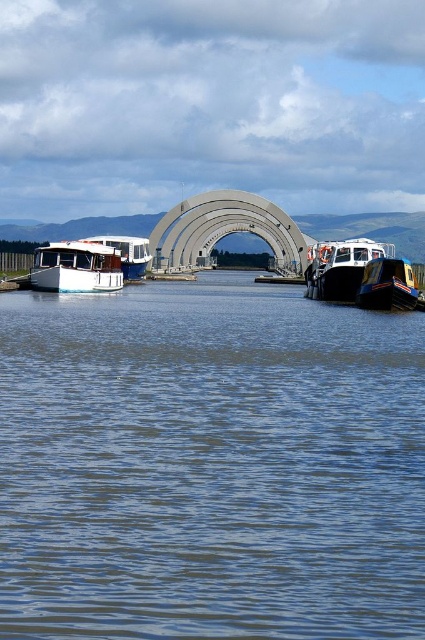
You are standing at the center of the waterway scene and want to reach both points. Which point, point [124,550] or point [37,257], will you reach first as you move forward?

You will reach point [124,550] first because it is closer to you than point [37,257].

You are a small toy boat that is 1 meter long. You want to sail through the waterway shown in the image. Can you fit between the blue water at center and the blue glossy boat at lower right without touching either?

The blue water at center is wider than the blue glossy boat at lower right. Since the waterway is wider than the boat, the toy boat can safely sail through without touching either side.

You are a tour guide leading a group on a narrow boat that is 18 meters long. You need to navigate between the blue glossy boat at lower right and the white glossy boat at left. Can your boat fit through the space between them without touching either boat?

The distance between the blue glossy boat at lower right and the white glossy boat at left is 20.22 meters. Since your boat is 18 meters long, it can fit through the space as there is enough clearance.